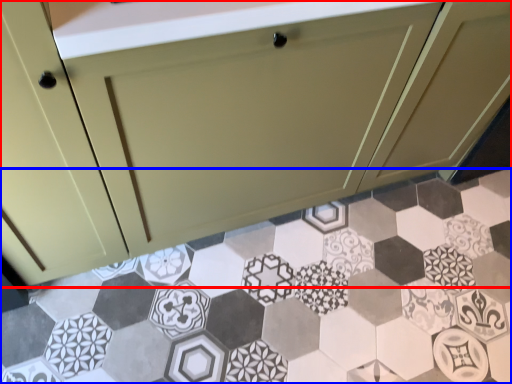
Question: Which object appears farthest to the camera in this image, cabinetry (highlighted by a red box) or porcelain (highlighted by a blue box)?

Choices:
 (A) cabinetry
 (B) porcelain

Answer: (B)